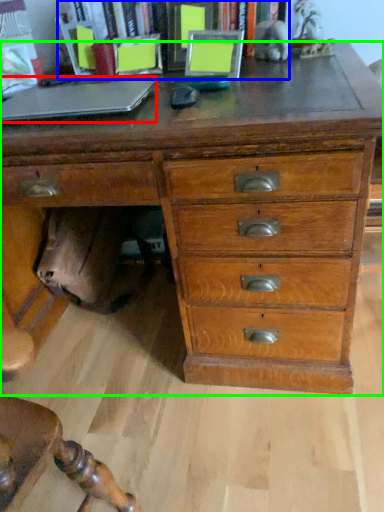
Question: Which is nearer to the laptop (highlighted by a red box)? bookcase (highlighted by a blue box) or chest of drawers (highlighted by a green box).

Choices:
 (A) bookcase
 (B) chest of drawers

Answer: (B)